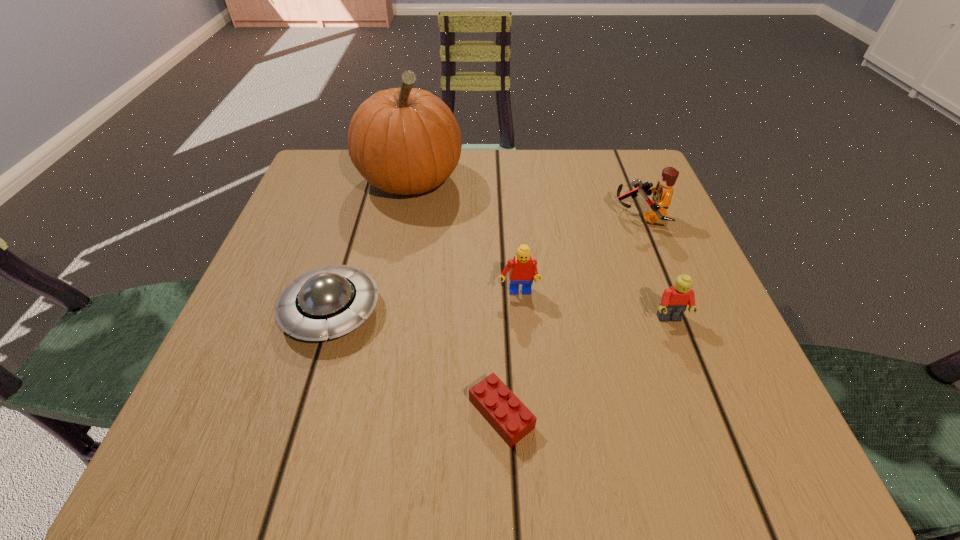
You are a GUI agent. You are given a task and a screenshot of the screen. Output one action in this format:
    pyautogui.click(x=<x>, y=<y>)
    Task: Click on the object identified as the closest to the second nearest Lego
    
    Given the screenshot: What is the action you would take?
    pyautogui.click(x=522, y=269)

At what (x,y) coordinates should I click in order to perform the action: click on Lego that is the third closest one to the second farthest Lego. Please return your answer as a coordinate pair (x, y). The height and width of the screenshot is (540, 960). Looking at the image, I should click on (662, 193).

This screenshot has width=960, height=540. I want to click on Lego that stands as the second closest to the tallest object, so 662,193.

You are a GUI agent. You are given a task and a screenshot of the screen. Output one action in this format:
    pyautogui.click(x=<x>, y=<y>)
    Task: Click on the vacant space that satisfies the following two spatial constraints: 1. holding a crossbow in the hands of the farthest Lego; 2. on the face of the second nearest Lego
    The width and height of the screenshot is (960, 540).
    Given the screenshot: What is the action you would take?
    pyautogui.click(x=681, y=319)